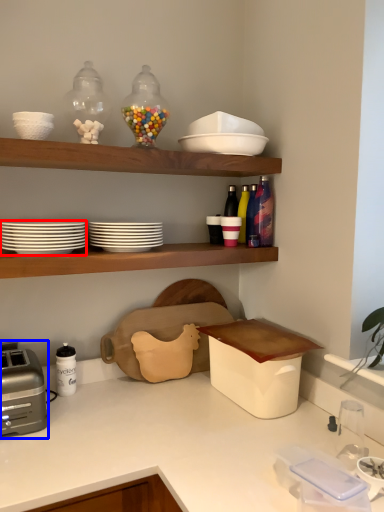
Question: Which point is closer to the camera, tableware (highlighted by a red box) or toaster (highlighted by a blue box)?

Choices:
 (A) tableware
 (B) toaster

Answer: (A)